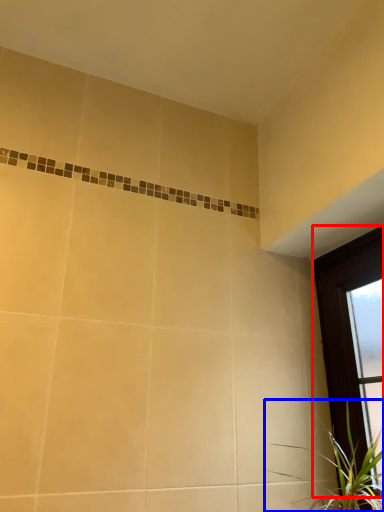
Question: Among these objects, which one is farthest to the camera, window (highlighted by a red box) or houseplant (highlighted by a blue box)?

Choices:
 (A) window
 (B) houseplant

Answer: (A)